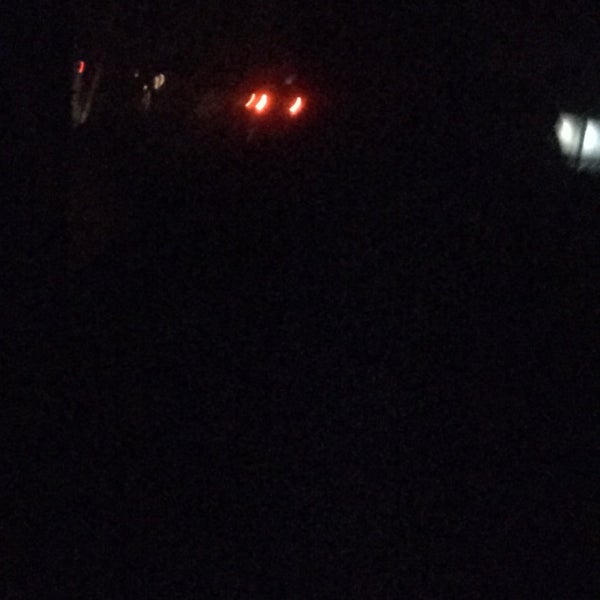
Identify the location of left white light. (564, 130).